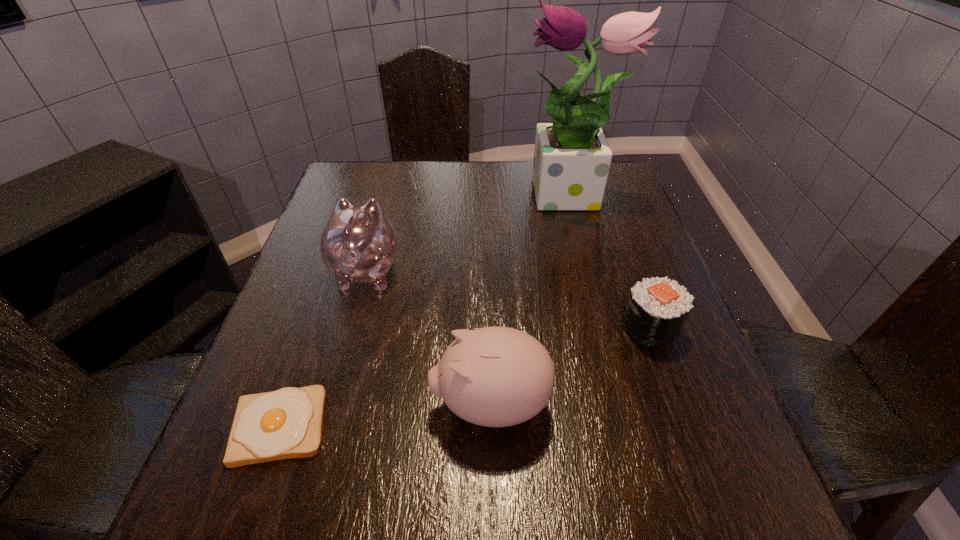
Identify the location of piggy bank present at the left edge. The image size is (960, 540). (358, 245).

Where is `toast that is at the left edge`? The image size is (960, 540). toast that is at the left edge is located at coordinates (287, 423).

Locate an element on the screen. The width and height of the screenshot is (960, 540). flower arrangement located at the right edge is located at coordinates (572, 157).

Locate an element on the screen. The image size is (960, 540). sushi that is at the right edge is located at coordinates (656, 309).

Locate an element on the screen. Image resolution: width=960 pixels, height=540 pixels. object located at the far right corner is located at coordinates (572, 157).

Image resolution: width=960 pixels, height=540 pixels. Find the location of `blank area at the left edge`. blank area at the left edge is located at coordinates (331, 342).

Image resolution: width=960 pixels, height=540 pixels. Identify the location of vacant space at the right edge of the desktop. (613, 252).

Locate an element on the screen. vacant space at the far left corner is located at coordinates (357, 190).

At what (x,y) coordinates should I click in order to perform the action: click on vacant region at the near left corner of the desktop. Please return your answer as a coordinate pair (x, y). This screenshot has width=960, height=540. Looking at the image, I should click on (275, 495).

In the image, there is a desktop. Identify the location of vacant space at the near right corner. (764, 515).